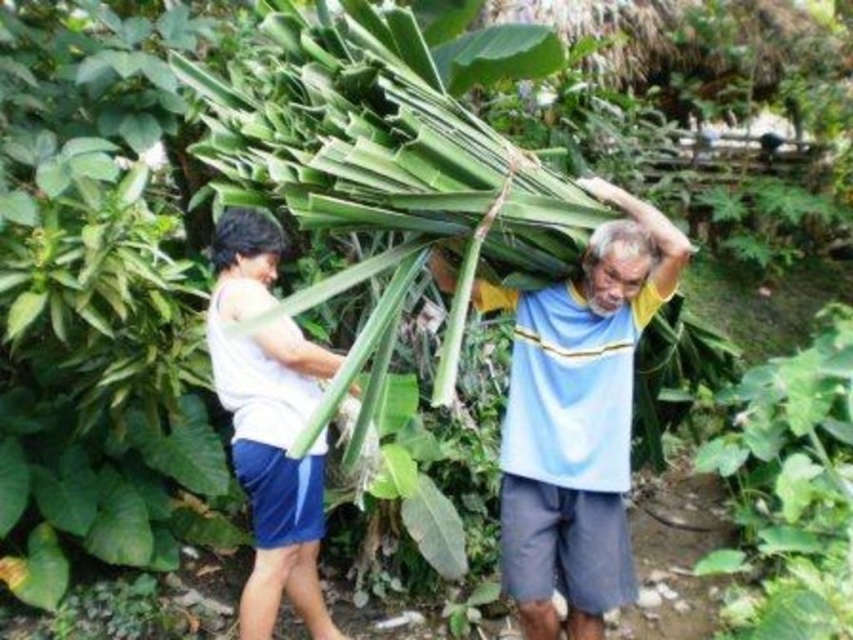
Question: Where is light blue striped shirt at upper center located in relation to white matte tank top at left in the image?

Choices:
 (A) left
 (B) right

Answer: (B)

Question: Does light blue striped shirt at upper center have a lesser width compared to white matte tank top at left?

Choices:
 (A) no
 (B) yes

Answer: (A)

Question: Can you confirm if light blue striped shirt at upper center is positioned below white matte tank top at left?

Choices:
 (A) yes
 (B) no

Answer: (B)

Question: Which point is closer to the camera?

Choices:
 (A) light blue striped shirt at upper center
 (B) white matte tank top at left

Answer: (A)

Question: Which object is closer to the camera taking this photo?

Choices:
 (A) white matte tank top at left
 (B) light blue striped shirt at upper center

Answer: (B)